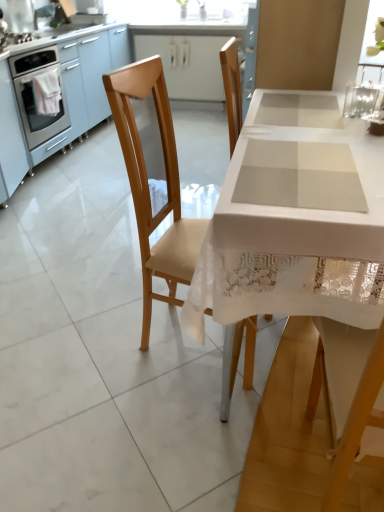
This screenshot has height=512, width=384. Find the location of `free space in front of wooden chair at left`. free space in front of wooden chair at left is located at coordinates (162, 431).